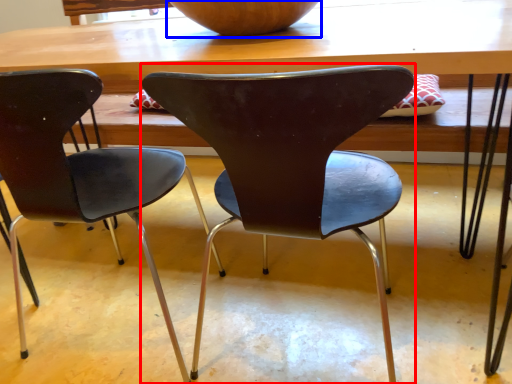
Question: Which object appears closest to the camera in this image, chair (highlighted by a red box) or bowl (highlighted by a blue box)?

Choices:
 (A) chair
 (B) bowl

Answer: (A)